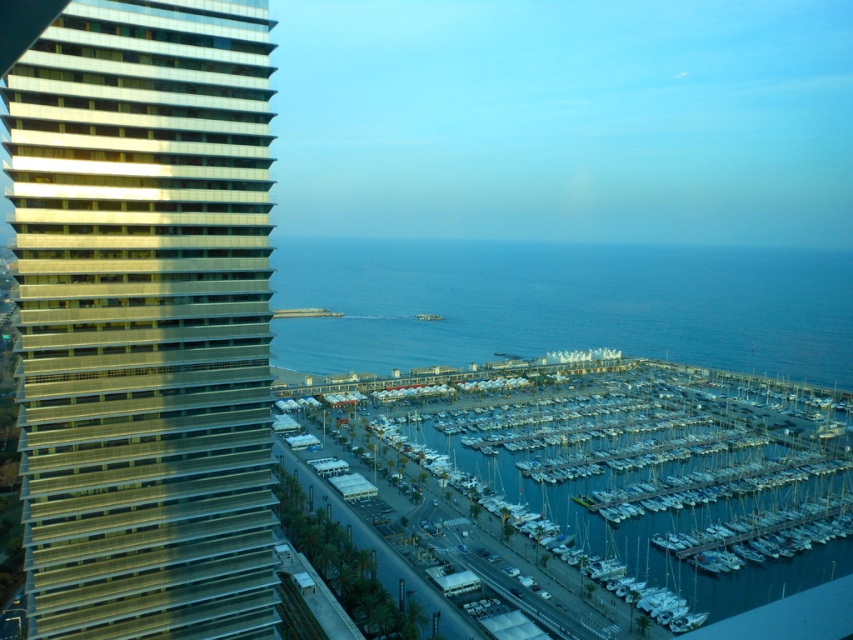
Question: Considering the real-world distances, which object is farthest from the white matte boats at center?

Choices:
 (A) metallic glass building at left
 (B) blue water at lower center

Answer: (B)

Question: Which object appears farthest from the camera in this image?

Choices:
 (A) white matte boats at center
 (B) metallic glass building at left
 (C) blue water at lower center

Answer: (C)

Question: Can you confirm if white matte boats at center is positioned to the right of blue water at lower center?

Choices:
 (A) yes
 (B) no

Answer: (B)

Question: Is metallic glass building at left to the right of white matte boats at center from the viewer's perspective?

Choices:
 (A) yes
 (B) no

Answer: (B)

Question: Based on their relative distances, which object is nearer to the white matte boats at center?

Choices:
 (A) blue water at lower center
 (B) metallic glass building at left

Answer: (B)

Question: Observing the image, what is the correct spatial positioning of metallic glass building at left in reference to white matte boats at center?

Choices:
 (A) below
 (B) above

Answer: (B)